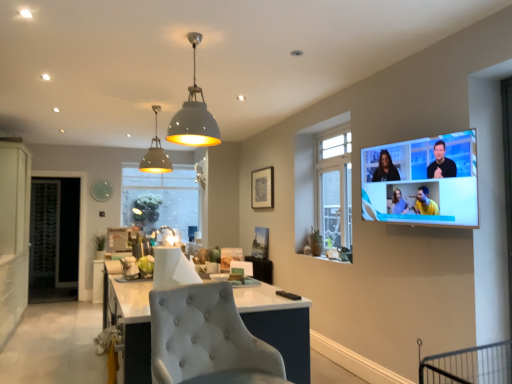
The height and width of the screenshot is (384, 512). What are the coordinates of `free location above matte gray pendant light at upper center (from a real-world perspective)` in the screenshot? It's located at pos(156,100).